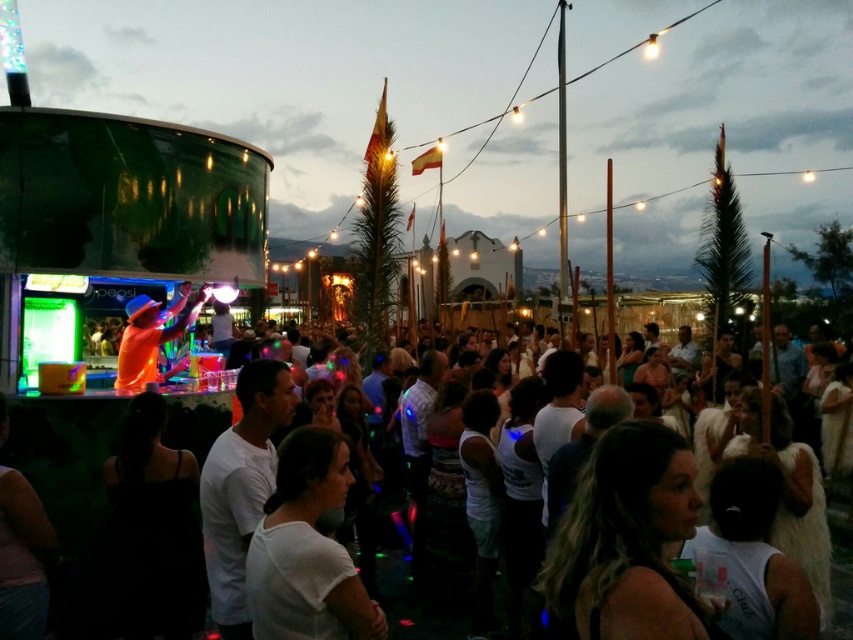
Looking at this image, is white matte shirt at center bigger than orange fabric dj at center?

No, white matte shirt at center is not bigger than orange fabric dj at center.

Is white matte shirt at center thinner than orange fabric dj at center?

Correct, white matte shirt at center's width is less than orange fabric dj at center's.

Does point (308, 488) lie behind point (128, 326)?

No, (308, 488) is closer to viewer.

The width and height of the screenshot is (853, 640). In order to click on white matte shirt at center in this screenshot , I will do `click(306, 548)`.

Who is shorter, white matte crowd at center or orange fabric dj at center?

orange fabric dj at center

Is white matte crowd at center bigger than orange fabric dj at center?

Correct, white matte crowd at center is larger in size than orange fabric dj at center.

Does point (227, 413) come behind point (137, 369)?

That is True.

The height and width of the screenshot is (640, 853). Identify the location of white matte crowd at center. (67, 456).

Is white matte crowd at center smaller than white matte shirt at center?

Actually, white matte crowd at center might be larger than white matte shirt at center.

Describe the element at coordinates (67, 456) in the screenshot. I see `white matte crowd at center` at that location.

Where is `white matte crowd at center`? This screenshot has width=853, height=640. white matte crowd at center is located at coordinates (67, 456).